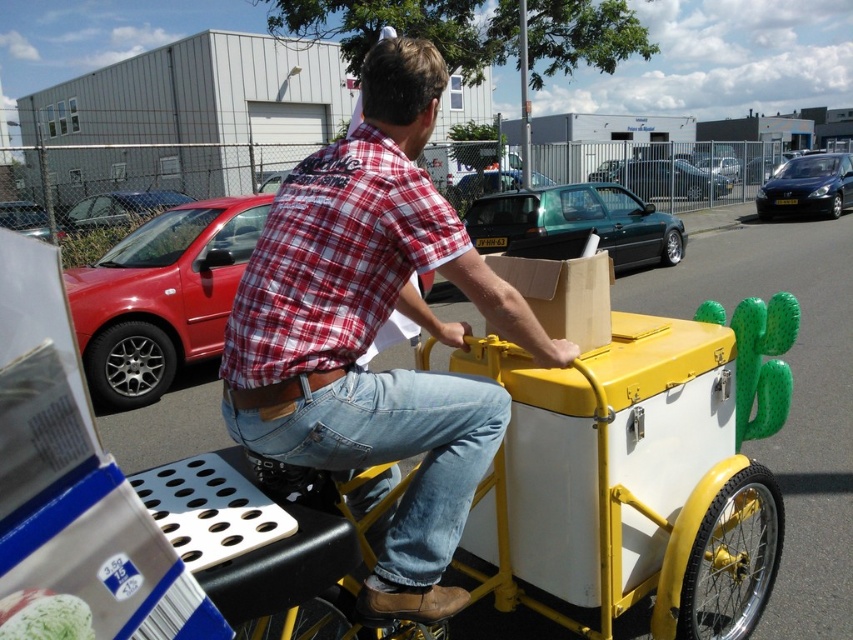
Looking at this image, you are standing at the origin point of the coordinate system. You want to move towards the green matte hatchback at center. Which direction should you move in?

The green matte hatchback at center is located at point 0.347 in the x direction and 0.678 in the y direction. So you should move towards the right and upwards to reach it.

You are a delivery driver who needs to park your cargo bike between the matte red car at left and the metallic blue car at right. Which car should you position your bike closer to if you want to avoid hitting the lower part of the cars?

You should position your bike closer to the metallic blue car at right because the matte red car at left has a greater height, making its lower part potentially harder to navigate around without hitting.